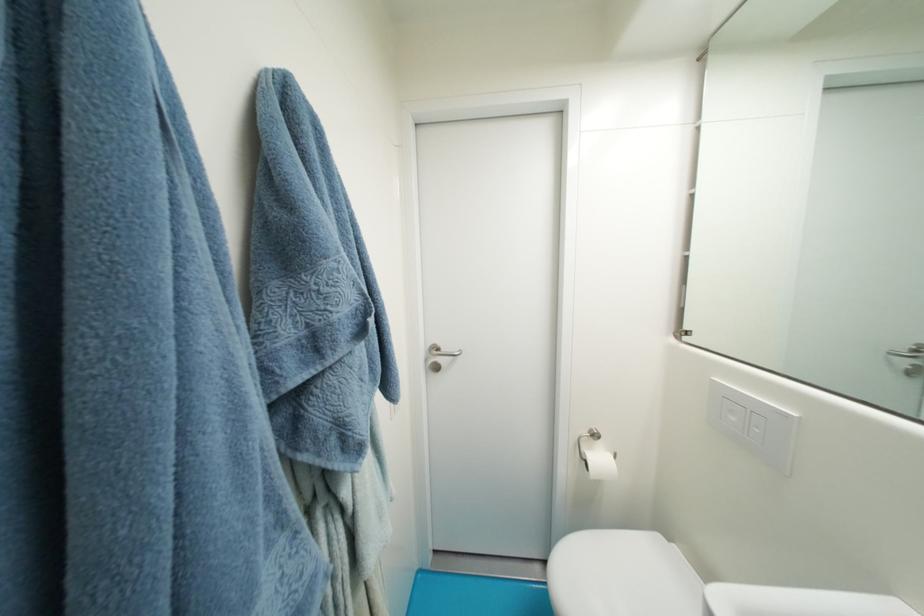
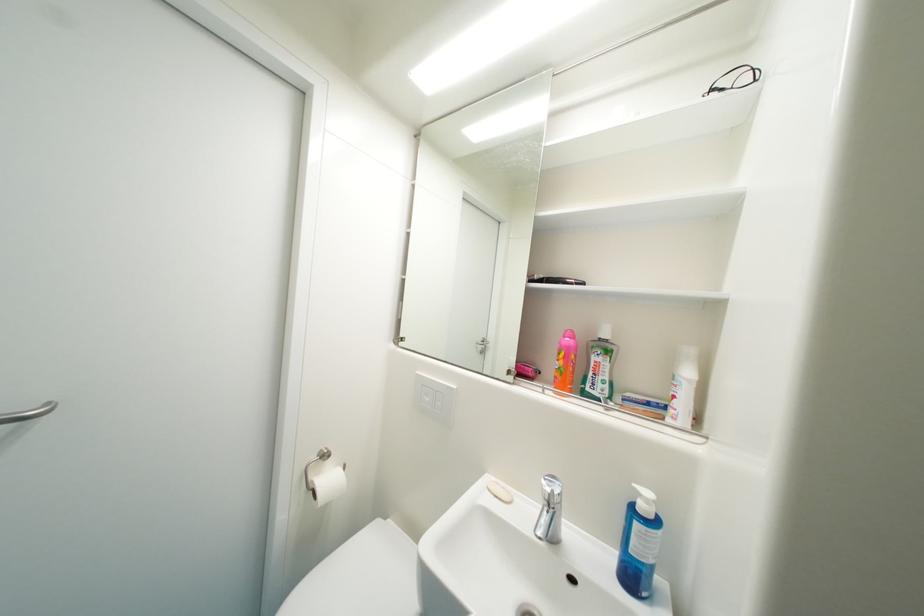
Find the pixel in the second image that matches pixel 467 352 in the first image.

(55, 405)